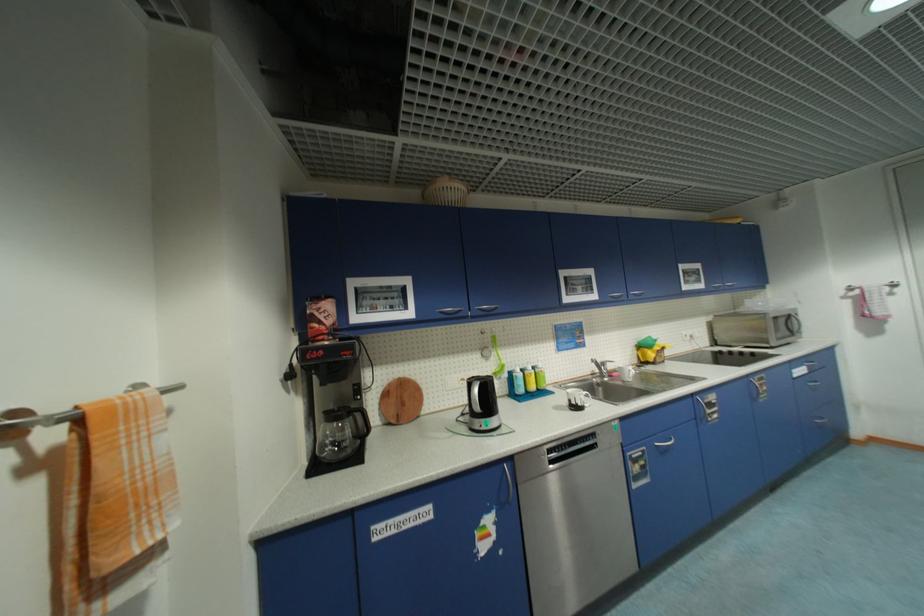
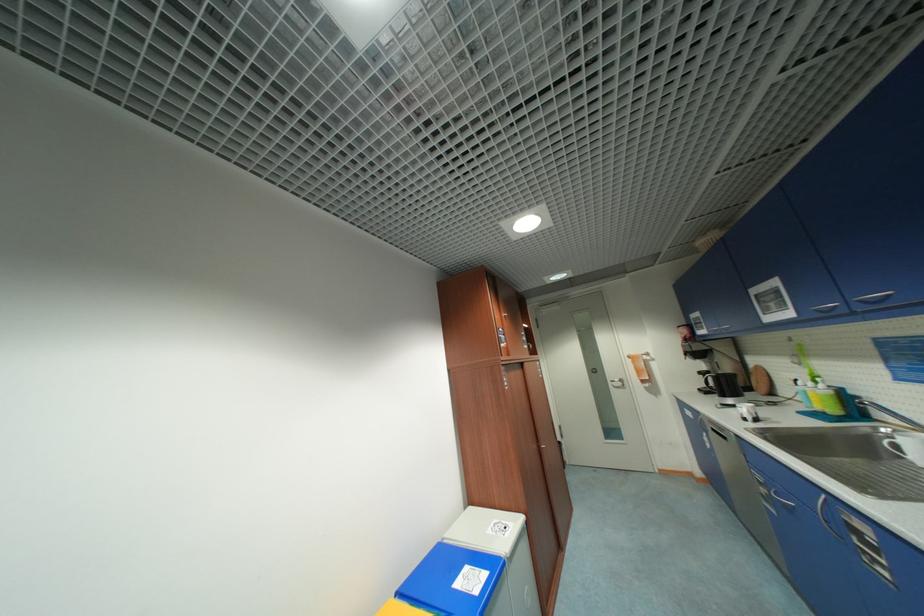
Where in the second image is the point corresponding to pixel 643 468 from the first image?

(768, 491)